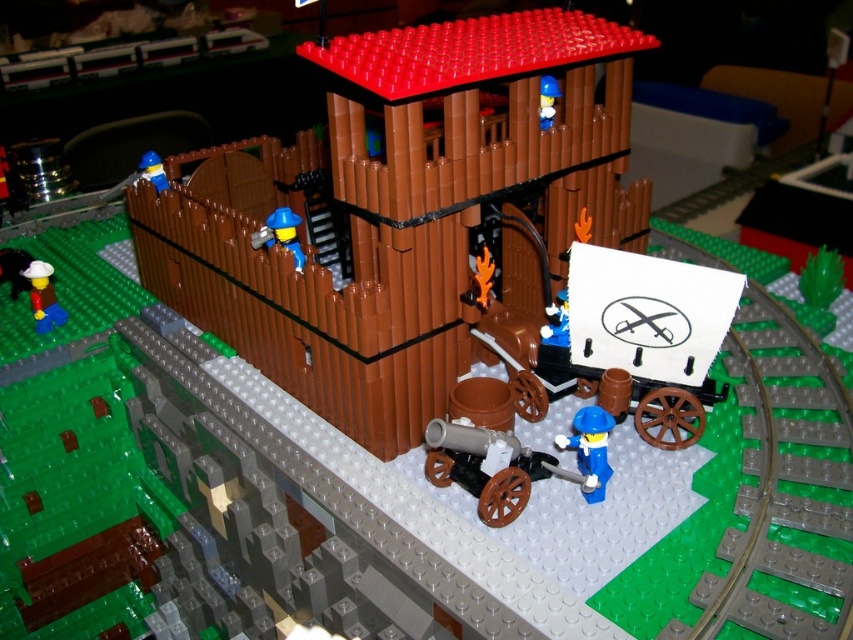
In the scene shown: You are a Lego figure trying to reach the cannon mounted on wheels in the lower right corner of the image. You are currently standing at the point marked by coordinates point (547,100). Which direction should you move to get to the cannon?

The point (547,100) is on the blue plastic minifigure at upper center. To reach the cannon mounted on wheels in the lower right corner, you should move downward and to the right from the blue plastic minifigure at upper center.

You are a visitor to this Lego fort and want to greet both blue plastic minifigure at upper center and blue plastic minifigure at upper left. Which one do you need to climb the staircase to reach?

You need to climb the staircase to reach the blue plastic minifigure at upper center because it is positioned above the blue plastic minifigure at upper left.